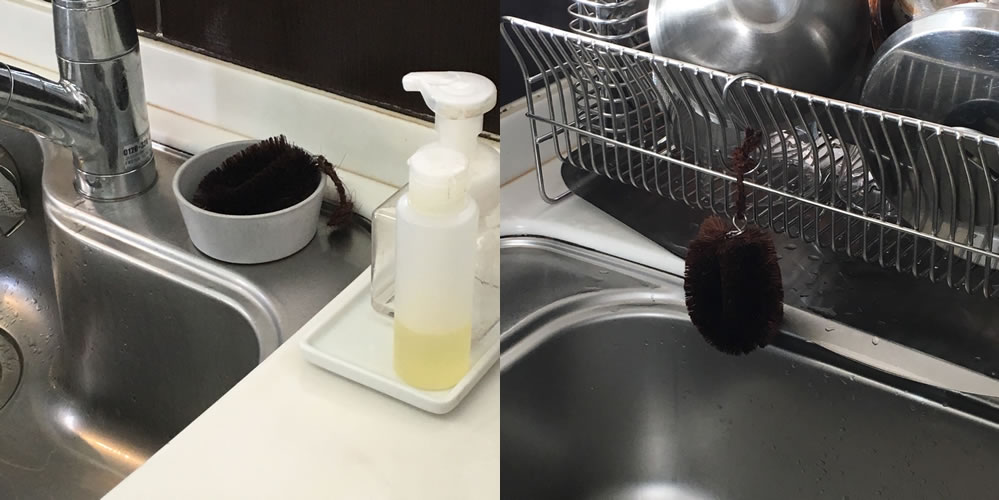
Where is `wall behind counter`? This screenshot has width=999, height=500. wall behind counter is located at coordinates (357, 134), (508, 164).